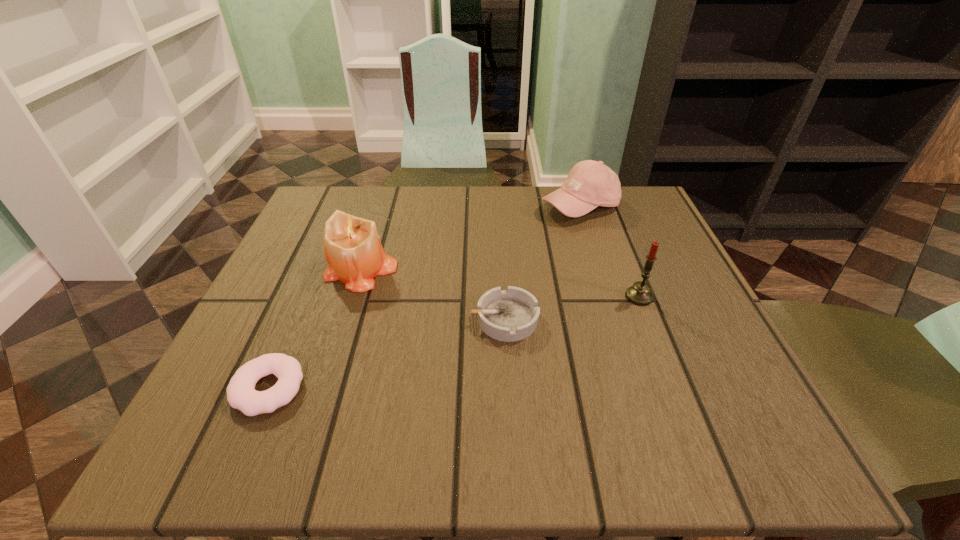
Identify the location of the left candle. This screenshot has height=540, width=960. (352, 247).

This screenshot has height=540, width=960. What are the coordinates of `the right candle` in the screenshot? It's located at 640,293.

This screenshot has width=960, height=540. I want to click on the farthest object, so click(x=590, y=184).

The height and width of the screenshot is (540, 960). I want to click on baseball cap, so click(x=590, y=184).

This screenshot has width=960, height=540. What are the coordinates of `the third object from right to left` in the screenshot? It's located at (511, 315).

Identify the location of the fourth tallest object. (511, 315).

Find the location of a particular element. The height and width of the screenshot is (540, 960). the nearest object is located at coordinates click(x=241, y=394).

Locate an element on the screen. This screenshot has width=960, height=540. doughnut is located at coordinates (241, 394).

Where is `free space located on the right of the left candle`? The height and width of the screenshot is (540, 960). free space located on the right of the left candle is located at coordinates [x=461, y=272].

The height and width of the screenshot is (540, 960). In order to click on vacant space situated on the back of the right candle in this screenshot , I will do [x=602, y=203].